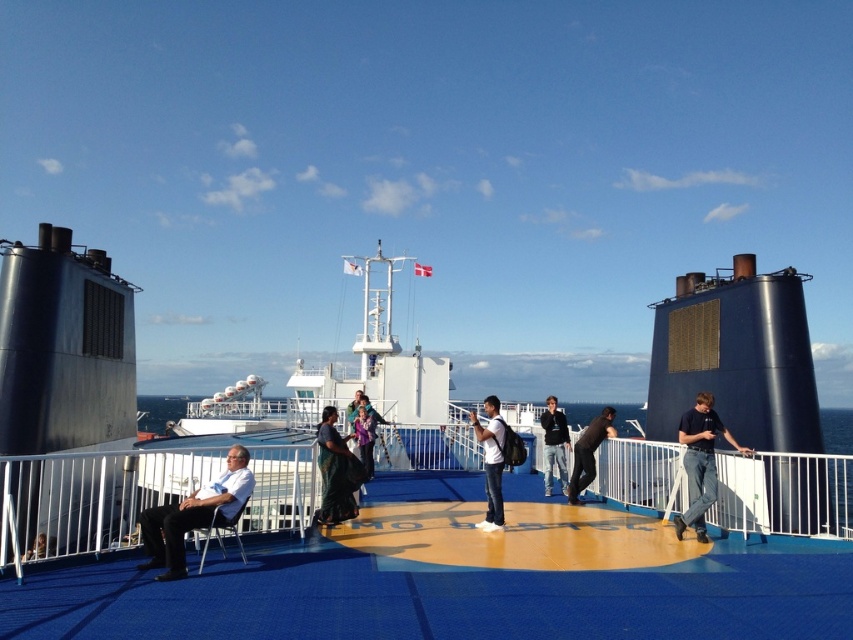
Question: Among these objects, which one is nearest to the camera?

Choices:
 (A) matte purple dress at center
 (B) light blue jeans at center

Answer: (B)

Question: Which point is farther from the camera taking this photo?

Choices:
 (A) (611, 422)
 (B) (373, 442)

Answer: (B)

Question: Does blue matte boat at center lie behind white cotton shirt at center?

Choices:
 (A) no
 (B) yes

Answer: (A)

Question: Can you confirm if silky green sari at center is positioned to the left of purple satin dress at center?

Choices:
 (A) yes
 (B) no

Answer: (A)

Question: Estimate the real-world distances between objects in this image. Which object is farther from the light blue jeans at center?

Choices:
 (A) dark blue shirt at center
 (B) white fabric chair at lower left
 (C) matte purple dress at center

Answer: (B)

Question: Does blue rubber deck at center come behind metallic blue chair at lower left?

Choices:
 (A) no
 (B) yes

Answer: (A)